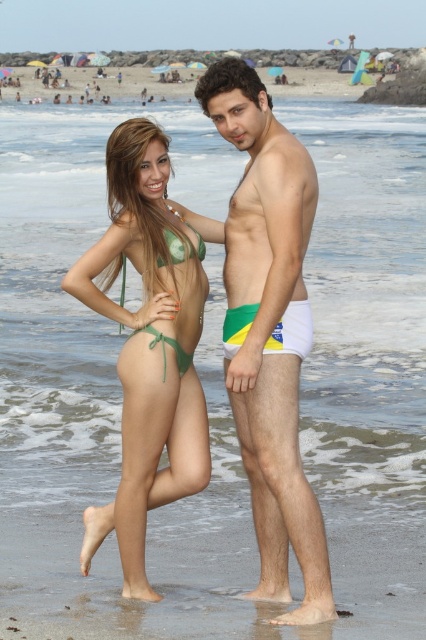
Is white matte underwear at center shorter than green matte bikini bottom at center?

No.

Describe the element at coordinates (268, 332) in the screenshot. This screenshot has width=426, height=640. I see `white matte underwear at center` at that location.

Is point (242, 374) positioned after point (170, 458)?

No, (242, 374) is closer to viewer.

The image size is (426, 640). I want to click on white matte underwear at center, so click(x=268, y=332).

Can you confirm if white fabric shorts at right is positioned above green fabric bikini at center?

Actually, white fabric shorts at right is below green fabric bikini at center.

Between point (293, 316) and point (180, 364), which one is positioned in front?

Point (293, 316) is more forward.

Locate an element on the screen. white fabric shorts at right is located at coordinates (291, 332).

Is white matte underwear at center smaller than white fabric shorts at right?

No, white matte underwear at center is not smaller than white fabric shorts at right.

Who is more distant from viewer, [244,403] or [284,332]?

The point [244,403] is behind.

At what (x,y) coordinates should I click in order to perform the action: click on white matte underwear at center. Please return your answer as a coordinate pair (x, y). This screenshot has width=426, height=640. Looking at the image, I should click on (268, 332).